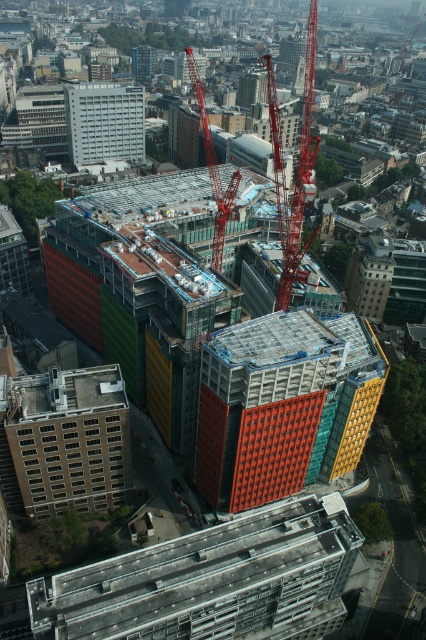
Question: Which of the following is the closest to the observer?

Choices:
 (A) brown concrete building at lower left
 (B) concrete roof at center
 (C) red metallic crane at center
 (D) orange textured building at center

Answer: (B)

Question: Which point is farther from the camera taking this photo?

Choices:
 (A) (28, 460)
 (B) (267, 88)
 (C) (196, 92)

Answer: (C)

Question: Is orange textured building at center bigger than white concrete building at center?

Choices:
 (A) yes
 (B) no

Answer: (A)

Question: Among these objects, which one is farthest from the camera?

Choices:
 (A) concrete roof at center
 (B) orange textured building at center

Answer: (B)

Question: Does orange textured building at center have a larger size compared to metallic red crane at center?

Choices:
 (A) yes
 (B) no

Answer: (B)

Question: Is concrete roof at center closer to the viewer compared to white concrete building at center?

Choices:
 (A) no
 (B) yes

Answer: (B)